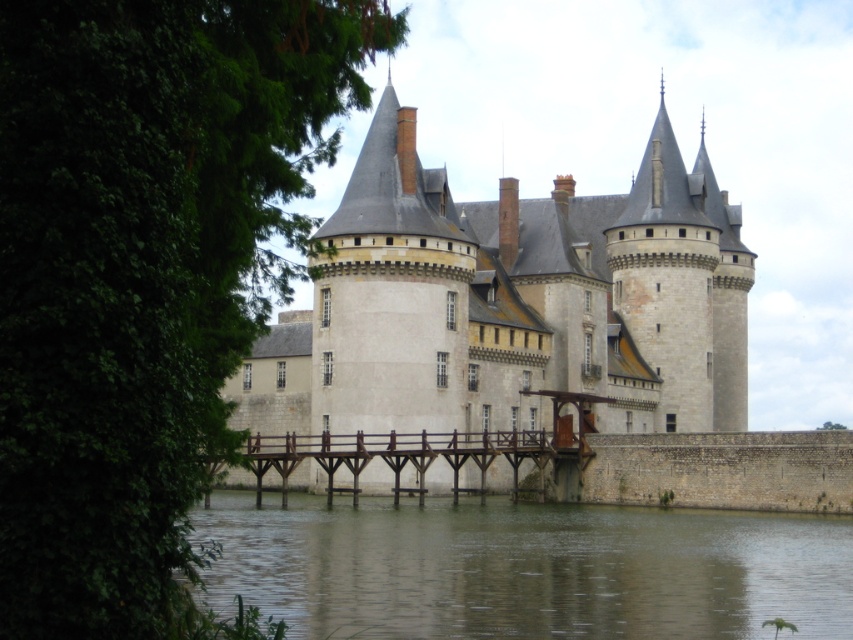
Can you confirm if stone gray castle at center is thinner than brown concrete river at lower center?

No.

Which is more to the left, stone gray castle at center or brown concrete river at lower center?

From the viewer's perspective, stone gray castle at center appears more on the left side.

Between point (393, 113) and point (418, 588), which one is positioned in front?

Positioned in front is point (418, 588).

At what (x,y) coordinates should I click in order to perform the action: click on stone gray castle at center. Please return your answer as a coordinate pair (x, y). Looking at the image, I should click on (509, 301).